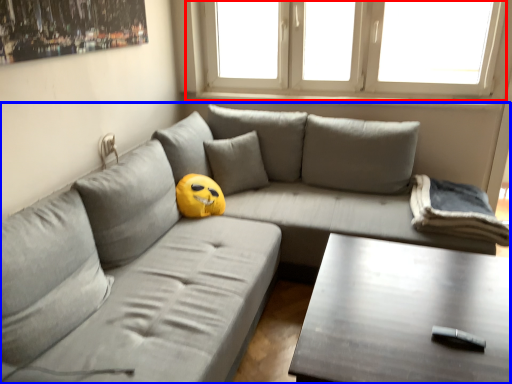
Question: Which point is closer to the camera, window (highlighted by a red box) or studio couch (highlighted by a blue box)?

Choices:
 (A) window
 (B) studio couch

Answer: (B)